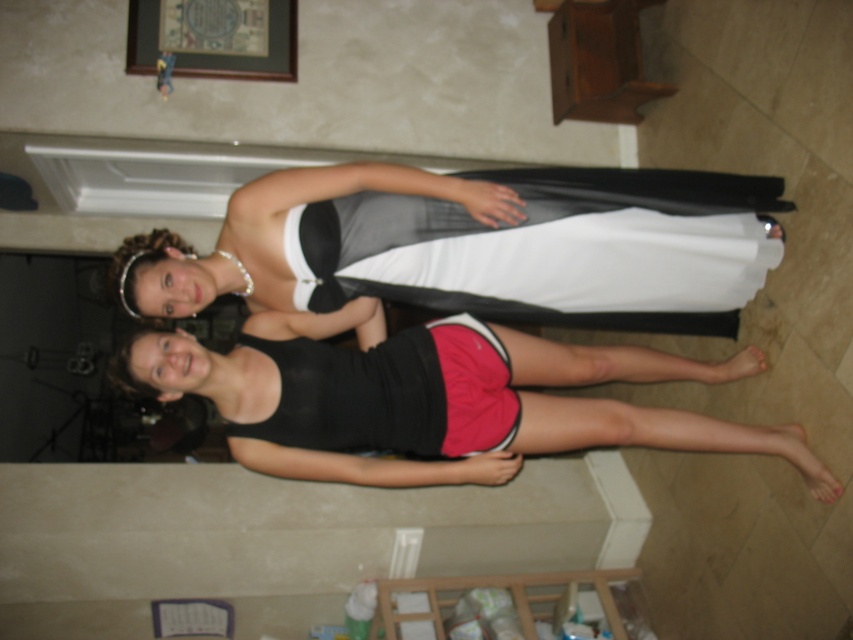
You are a photographer trying to capture a clear shot of both the matte black dress at center and the black matte shorts at lower center. Since you want both items to be in focus, which one should you adjust your camera focus on first?

The matte black dress at center is closer to the viewer than the black matte shorts at lower center. To ensure both are in focus, you should focus on the matte black dress at center first, as it is nearer, and the shorts will fall into the depth of field range.

You are a photographer setting up a shoot in this room. You need to position a backdrop that is 1.5 meters tall. Considering the matte black dress at center and the black matte shorts at lower center, which object is shorter and can help determine if the backdrop will fit in the space?

The matte black dress at center is shorter than the black matte shorts at lower center. Since the backdrop is 1.5 meters tall, you should compare its height to the taller object, the black matte shorts at lower center, to ensure it fits.

Looking at this image, you are a photographer standing 1.8 meters away from the matte black dress at center. Can you reach the dress to adjust its position without moving closer?

The matte black dress at center and viewer are 1.81 meters apart, so you are 1.8 meters away. Since the distance is almost the same, you might be able to reach the dress with an outstretched arm, but it might be slightly out of reach. Consider moving a small step closer for better access.